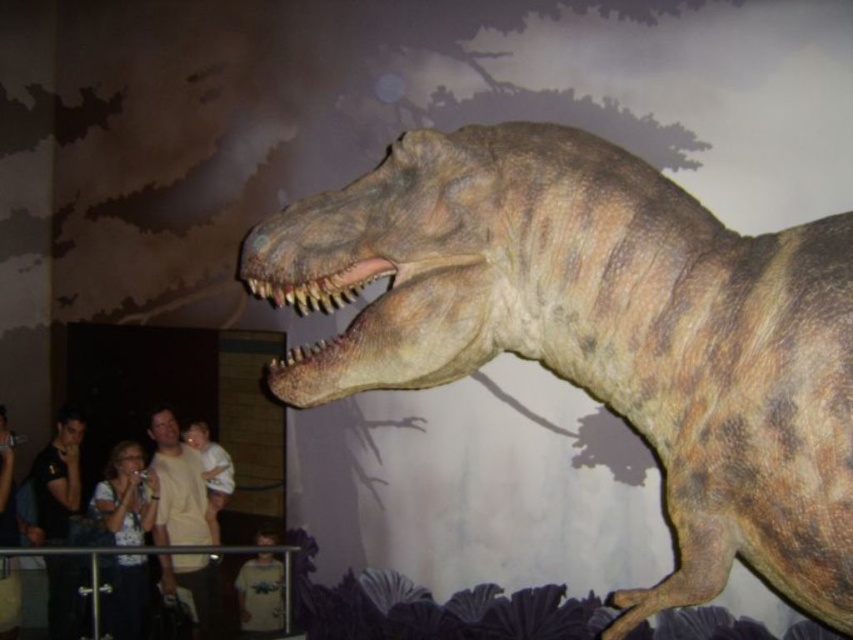
What do you see at coordinates (57, 477) in the screenshot? I see `black t-shirt at left` at bounding box center [57, 477].

Where is `black t-shirt at left`? black t-shirt at left is located at coordinates (57, 477).

Is light brown t-shirt at lower center behind light brown fabric shirt at lower left?

That is False.

Is point (256, 604) closer to camera compared to point (0, 515)?

Yes, it is.

The height and width of the screenshot is (640, 853). I want to click on light brown t-shirt at lower center, so click(260, 596).

From the picture: Between white cotton shirt at lower left and light brown t-shirt at lower center, which one appears on the left side from the viewer's perspective?

Positioned to the left is white cotton shirt at lower left.

Is point (120, 480) behind point (248, 596)?

That is True.

Where is `white cotton shirt at lower left`? white cotton shirt at lower left is located at coordinates (126, 496).

Find the location of `white cotton shirt at lower left`. white cotton shirt at lower left is located at coordinates (126, 496).